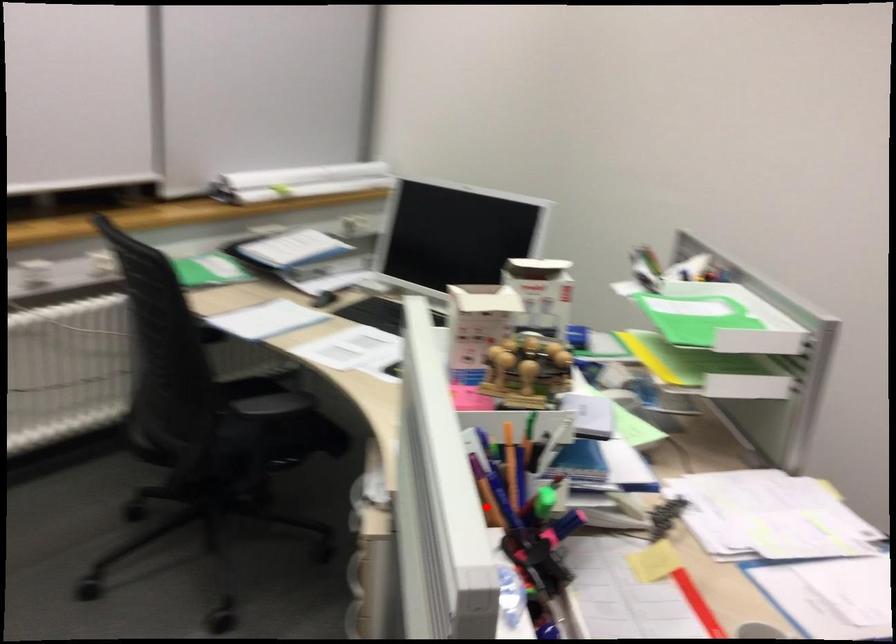
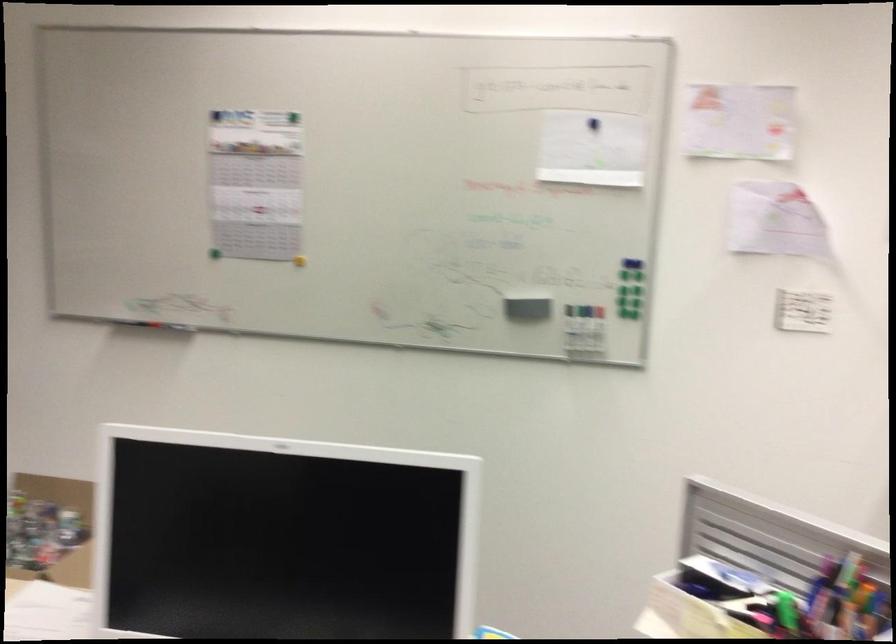
Question: I am providing you with two images of the same scene from different viewpoints. Given a red point in image1, look at the same physical point in image2. Is it:

Choices:
 (A) Closer to the viewpoint
 (B) Farther from the viewpoint

Answer: (B)